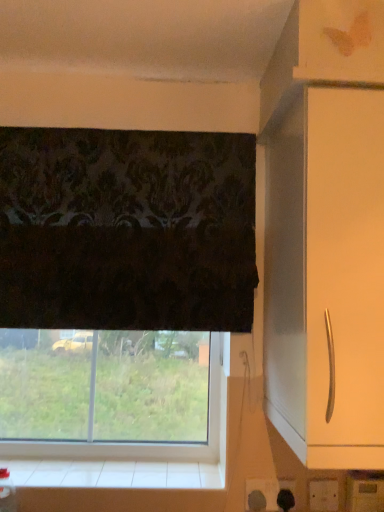
Question: Can you confirm if transparent glass window at lower center is positioned to the left of white tile at lower center?

Choices:
 (A) yes
 (B) no

Answer: (A)

Question: Considering the relative sizes of transparent glass window at lower center and white tile at lower center in the image provided, is transparent glass window at lower center taller than white tile at lower center?

Choices:
 (A) yes
 (B) no

Answer: (A)

Question: Is transparent glass window at lower center wider than white tile at lower center?

Choices:
 (A) no
 (B) yes

Answer: (A)

Question: Does transparent glass window at lower center have a larger size compared to white tile at lower center?

Choices:
 (A) no
 (B) yes

Answer: (B)

Question: Does transparent glass window at lower center have a smaller size compared to white tile at lower center?

Choices:
 (A) yes
 (B) no

Answer: (B)

Question: Is transparent glass window at lower center outside white tile at lower center?

Choices:
 (A) yes
 (B) no

Answer: (A)

Question: Would you say transparent glass window at lower center is outside white glossy cabinet handle at right?

Choices:
 (A) no
 (B) yes

Answer: (B)

Question: From a real-world perspective, is transparent glass window at lower center below white glossy cabinet handle at right?

Choices:
 (A) yes
 (B) no

Answer: (A)

Question: From the image's perspective, is transparent glass window at lower center under white glossy cabinet handle at right?

Choices:
 (A) yes
 (B) no

Answer: (A)

Question: Does transparent glass window at lower center appear on the right side of white glossy cabinet handle at right?

Choices:
 (A) yes
 (B) no

Answer: (B)

Question: From the image's perspective, is transparent glass window at lower center above white glossy cabinet handle at right?

Choices:
 (A) no
 (B) yes

Answer: (A)

Question: Could you tell me if transparent glass window at lower center is turned towards white glossy cabinet handle at right?

Choices:
 (A) no
 (B) yes

Answer: (A)

Question: From the image's perspective, is white glossy cabinet handle at right over transparent glass window at lower center?

Choices:
 (A) no
 (B) yes

Answer: (B)